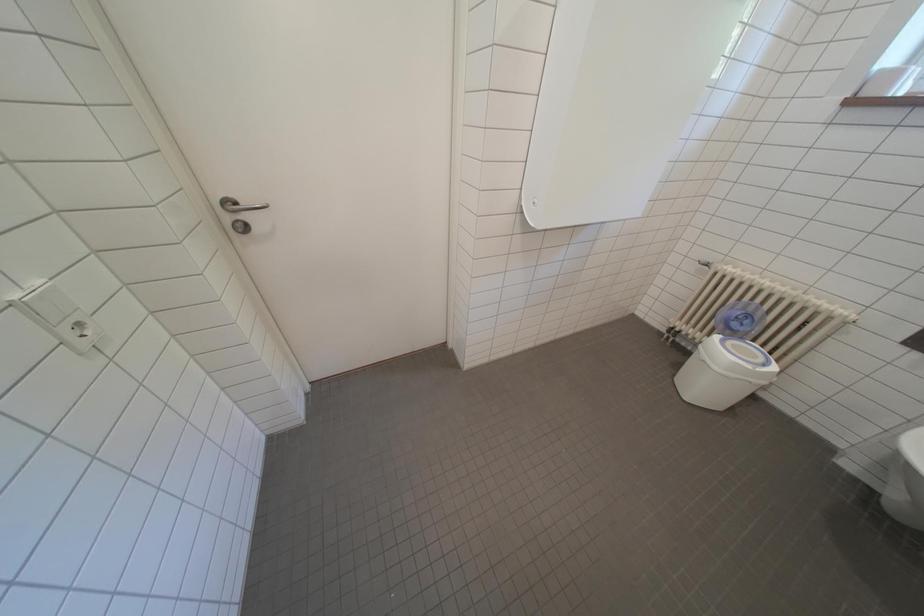
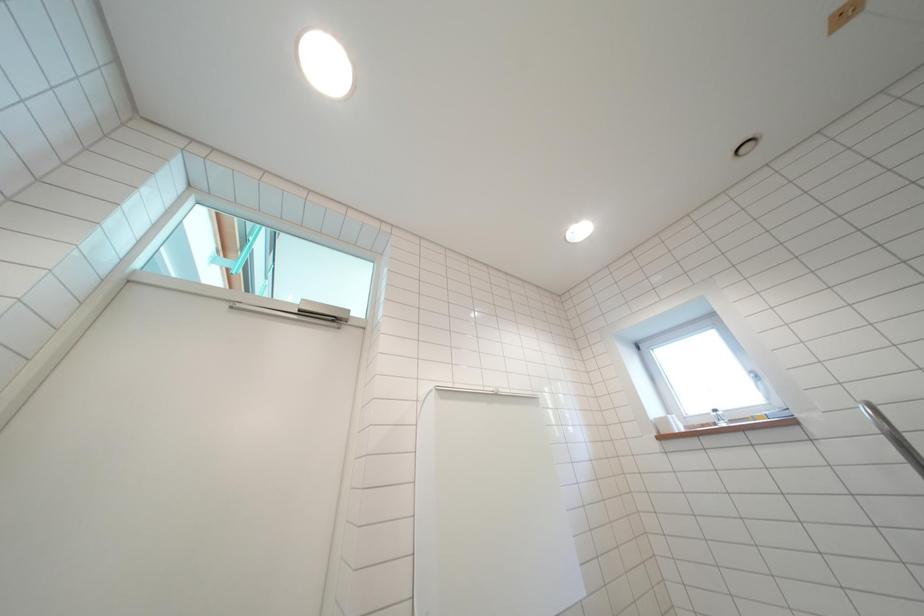
The first image is from the beginning of the video and the second image is from the end. How did the camera likely rotate when shooting the video?

The camera's rotation is toward right-up.